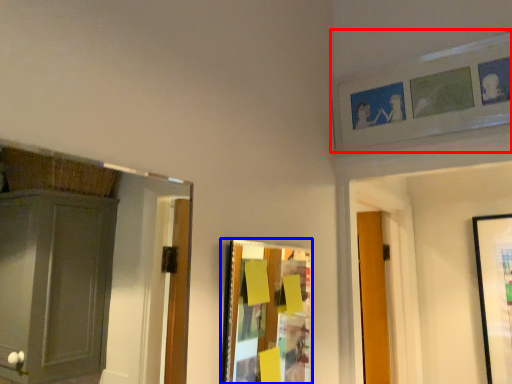
Question: Which object appears closest to the camera in this image, picture frame (highlighted by a red box) or picture frame (highlighted by a blue box)?

Choices:
 (A) picture frame
 (B) picture frame

Answer: (B)